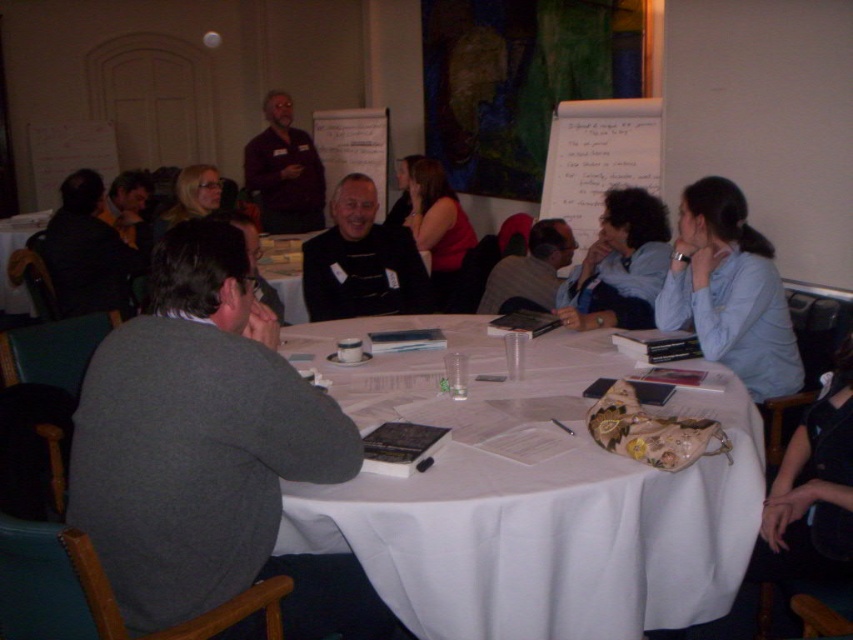
Question: Does white cloth at center appear on the right side of gray sweater at center?

Choices:
 (A) no
 (B) yes

Answer: (A)

Question: Which point is farther to the camera?

Choices:
 (A) light blue shirt at upper right
 (B) dark brown shirt at upper center
 (C) blue fabric shirt at center

Answer: (B)

Question: Which object is farther from the camera taking this photo?

Choices:
 (A) gray sweater at center
 (B) white cloth at center
 (C) dark brown shirt at upper center

Answer: (C)

Question: Can you confirm if white cloth at center is smaller than gray sweater at center?

Choices:
 (A) no
 (B) yes

Answer: (A)

Question: Is white cloth at center further to the viewer compared to dark brown shirt at upper center?

Choices:
 (A) no
 (B) yes

Answer: (A)

Question: Which point is closer to the camera?

Choices:
 (A) (532, 273)
 (B) (759, 339)
 (C) (762, 490)
 (D) (599, 273)

Answer: (C)